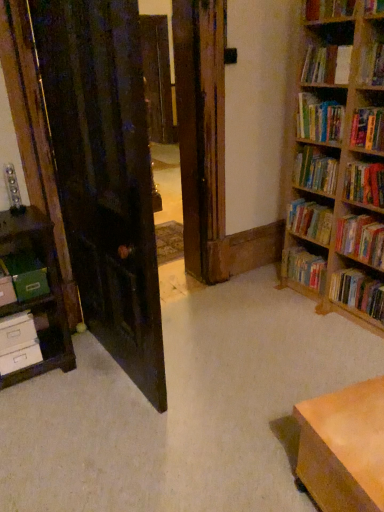
Identify the location of free point below hardcover book at lower right, the eighth book when ordered from top to bottom (from a real-world perspective). Image resolution: width=384 pixels, height=512 pixels. (303, 296).